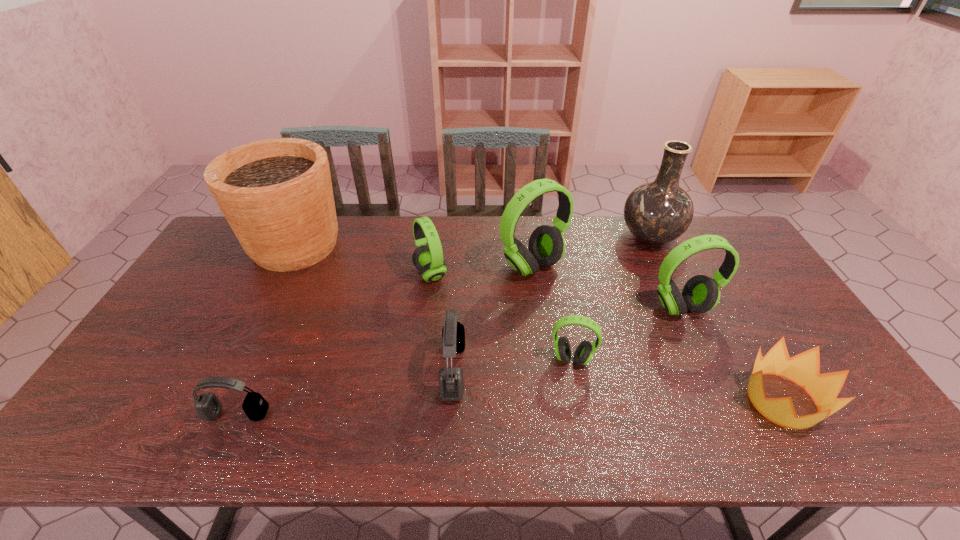
Locate an element on the screen. This screenshot has height=540, width=960. vacant space at the far edge of the desktop is located at coordinates (444, 240).

You are a GUI agent. You are given a task and a screenshot of the screen. Output one action in this format:
    pyautogui.click(x=<x>, y=<y>)
    Task: Click on the vacant region at the near edge of the desktop
    The width and height of the screenshot is (960, 540).
    Given the screenshot: What is the action you would take?
    pyautogui.click(x=527, y=428)

Image resolution: width=960 pixels, height=540 pixels. Identify the location of free space at the left edge of the desktop. (225, 295).

Image resolution: width=960 pixels, height=540 pixels. I want to click on free space at the right edge of the desktop, so click(803, 411).

The height and width of the screenshot is (540, 960). I want to click on vacant point at the near right corner, so click(875, 438).

Where is `vacant space in between the nearest headset and the flowerpot`? vacant space in between the nearest headset and the flowerpot is located at coordinates (266, 330).

The width and height of the screenshot is (960, 540). I want to click on empty location between the fifth headset from right to left and the left black headset, so click(334, 344).

Locate an element on the screen. free space between the farther black headset and the vase is located at coordinates (552, 304).

Where is `vacant area between the left black headset and the crown`? The height and width of the screenshot is (540, 960). vacant area between the left black headset and the crown is located at coordinates (510, 407).

Locate an element on the screen. Image resolution: width=960 pixels, height=540 pixels. free point between the biggest green headset and the vase is located at coordinates (591, 252).